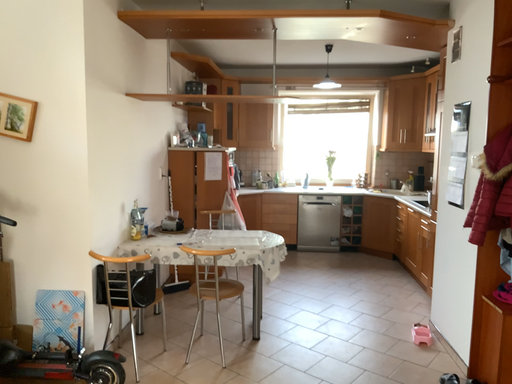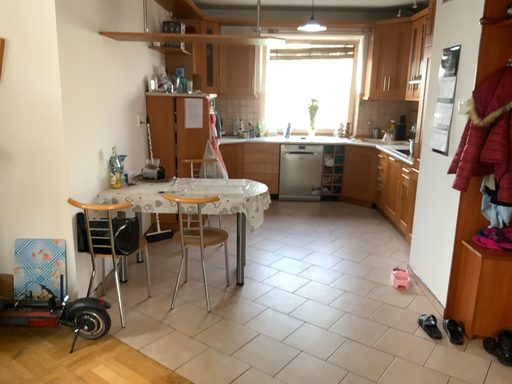
Question: Which way did the camera rotate in the video?

Choices:
 (A) rotated upward
 (B) rotated downward

Answer: (B)